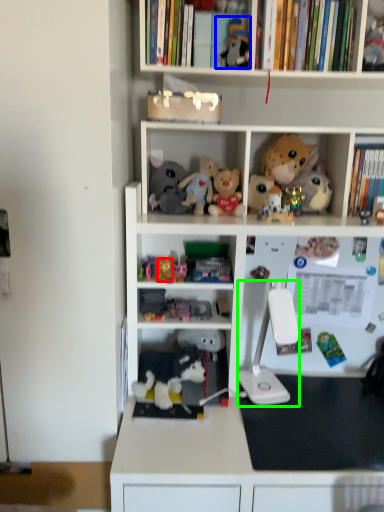
Question: Which object is the farthest from toy (highlighted by a red box)? Choose among these: toy (highlighted by a blue box) or equipment (highlighted by a green box).

Choices:
 (A) toy
 (B) equipment

Answer: (A)